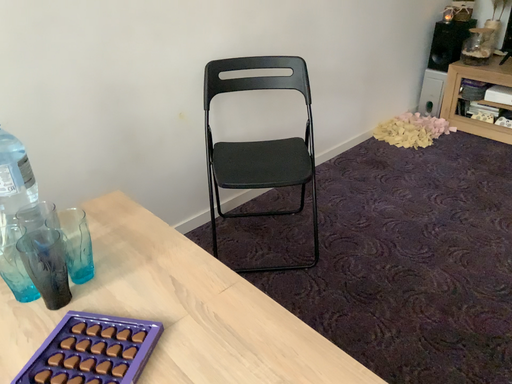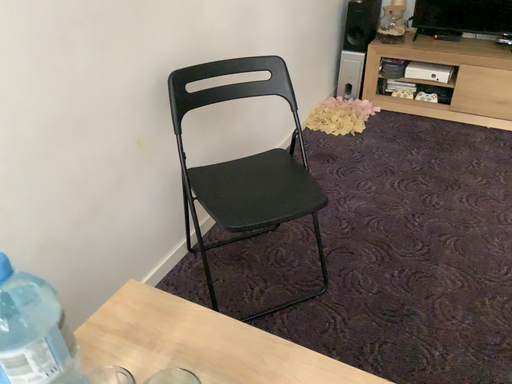
Question: Which way did the camera rotate in the video?

Choices:
 (A) rotated left
 (B) rotated right

Answer: (B)